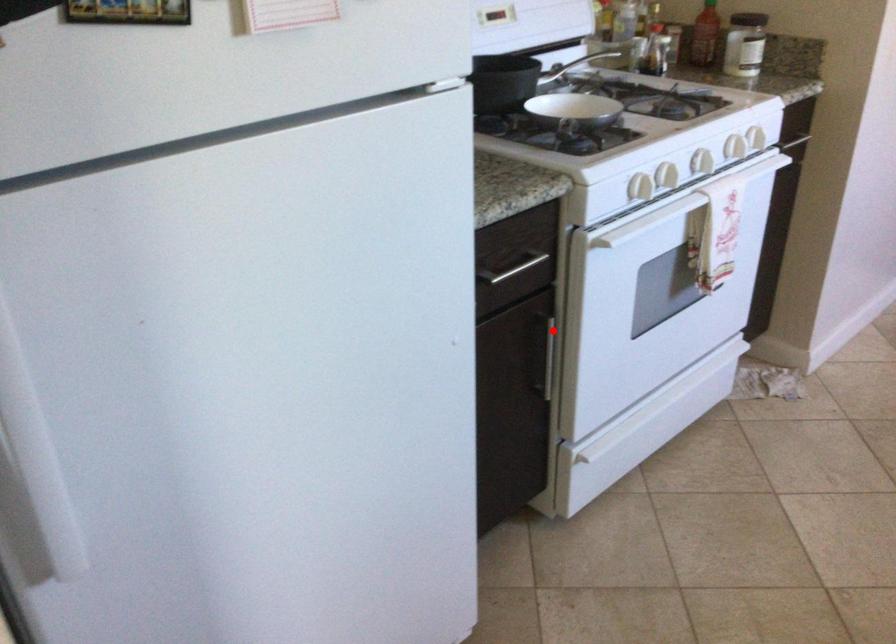
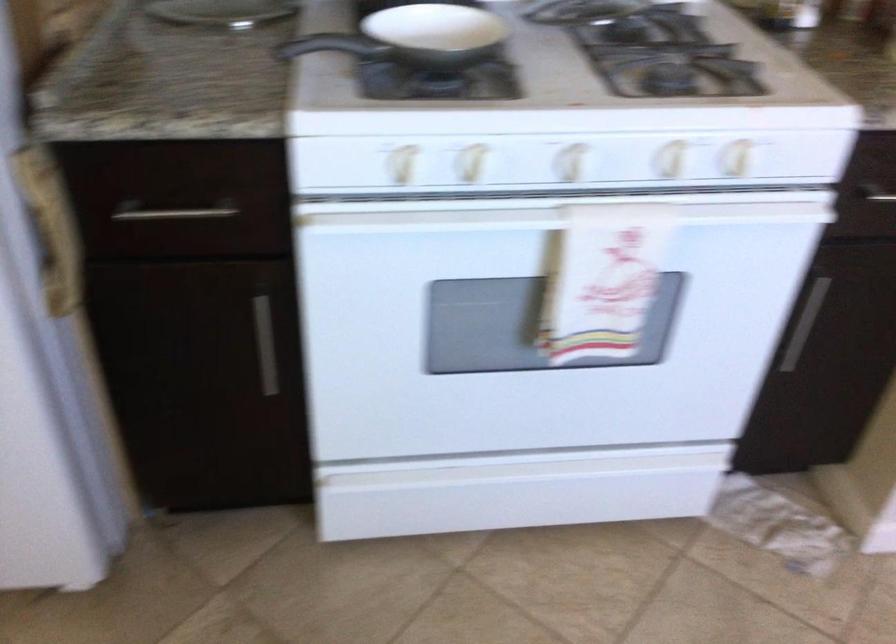
Question: I am providing you with two images of the same scene from different viewpoints. In image1, a red point is highlighted. Considering the same 3D point in image2, which of the following is correct?

Choices:
 (A) It is closer
 (B) It is farther

Answer: (A)